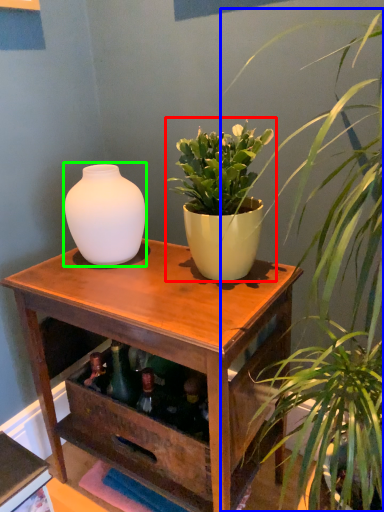
Question: Estimate the real-world distances between objects in this image. Which object is closer to houseplant (highlighted by a red box), houseplant (highlighted by a blue box) or vase (highlighted by a green box)?

Choices:
 (A) houseplant
 (B) vase

Answer: (A)